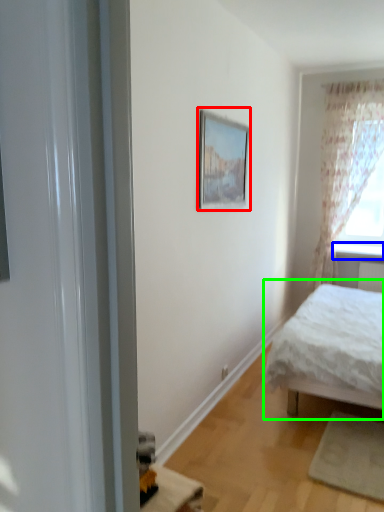
Question: Which object is positioned closest to picture frame (highlighted by a red box)? Select from window sill (highlighted by a blue box) and bed (highlighted by a green box).

Choices:
 (A) window sill
 (B) bed

Answer: (B)